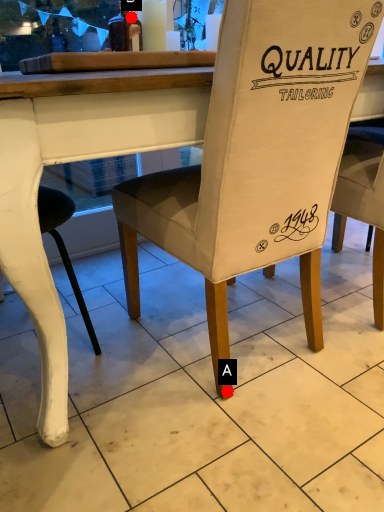
Question: Two points are circled on the image, labeled by A and B beside each circle. Which point is closer to the camera taking this photo?

Choices:
 (A) A is closer
 (B) B is closer

Answer: (A)